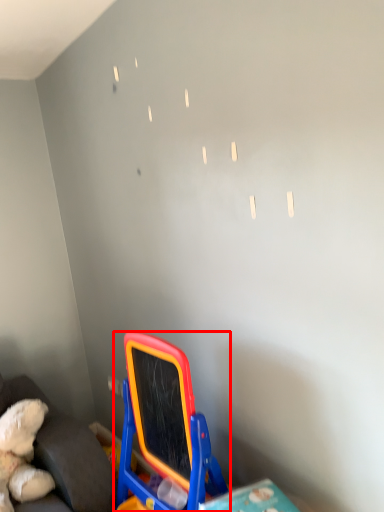
Question: From the image's perspective, what is the correct spatial relationship of toy (annotated by the red box) in relation to furniture?

Choices:
 (A) above
 (B) below

Answer: (A)